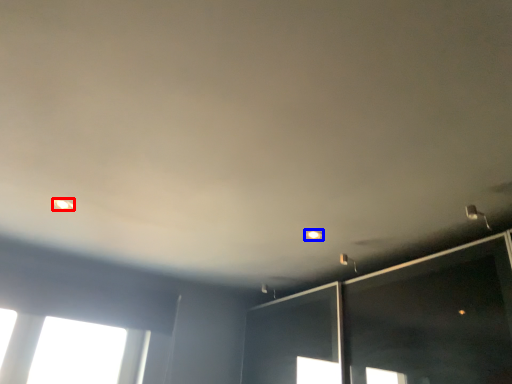
Question: Which point is further to the camera, dot (highlighted by a red box) or dot (highlighted by a blue box)?

Choices:
 (A) dot
 (B) dot

Answer: (B)